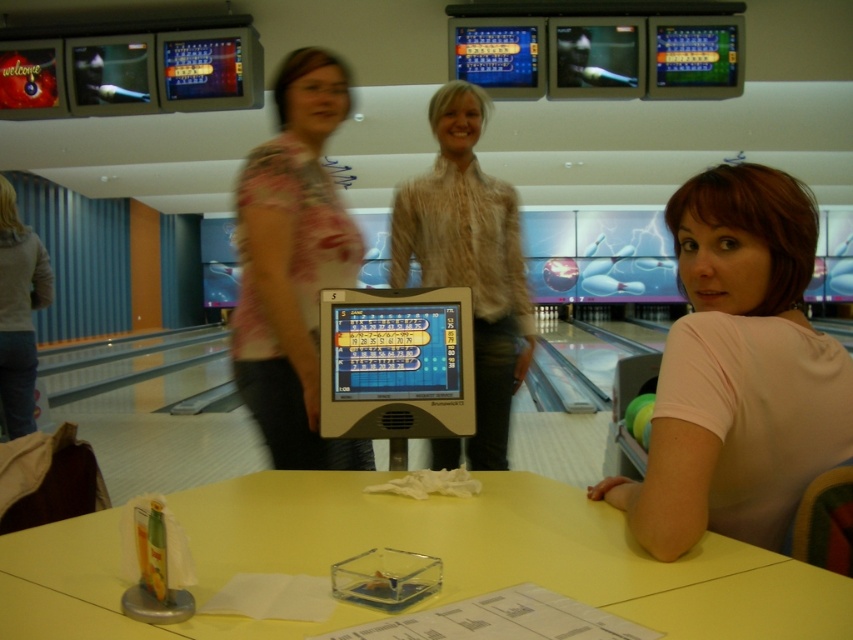
You are a photographer positioned at the end of the bowling alley. You need to capture a photo of both the pink matte shirt at center and the denim pants at left. Based on their positions, which object should you adjust your camera focus on first to ensure both are in frame?

The pink matte shirt at center is to the right of denim pants at left. To ensure both are in frame, focus on the denim pants at left first, then adjust to include the pink matte shirt at center to the right.

You are a photographer standing at the camera position. You want to capture a clear photo of the floral fabric blouse at center. Is the distance between you and the blouse sufficient to take a sharp photo with your standard camera lens?

The floral fabric blouse at center and camera are 5.60 feet apart from each other. A standard camera lens can focus clearly at this distance, so yes, the distance is sufficient to take a sharp photo.

You are a bowling alley attendant who needs to retrieve a dropped bowling ball from the floor. The ball is located between the pink matte shirt at center and denim pants at left. Considering the distance between them, can you safely walk through the space to pick it up without stepping into either person?

The distance between the pink matte shirt at center and denim pants at left is 3.01 meters, so yes, you can safely walk through the space to pick up the ball as there is enough room between them.